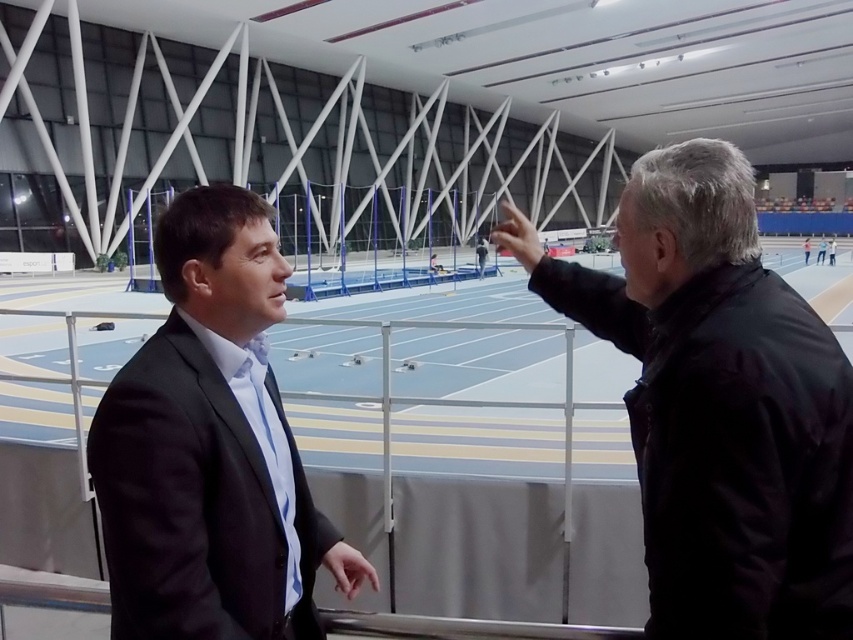
Question: Which of the following is the farthest from the observer?

Choices:
 (A) black matte jacket at right
 (B) blue silk tie at left

Answer: (B)

Question: Based on their relative distances, which object is farther from the black matte jacket at right?

Choices:
 (A) matte black suit at center
 (B) blue silk tie at left

Answer: (A)

Question: Is matte black suit at center to the left of blue silk tie at left from the viewer's perspective?

Choices:
 (A) no
 (B) yes

Answer: (B)

Question: Can you confirm if black matte jacket at right is positioned to the left of matte black suit at center?

Choices:
 (A) yes
 (B) no

Answer: (B)

Question: Based on their relative distances, which object is nearer to the black matte jacket at right?

Choices:
 (A) matte black suit at center
 (B) blue silk tie at left

Answer: (B)

Question: Can you confirm if black matte jacket at right is positioned above blue silk tie at left?

Choices:
 (A) yes
 (B) no

Answer: (A)